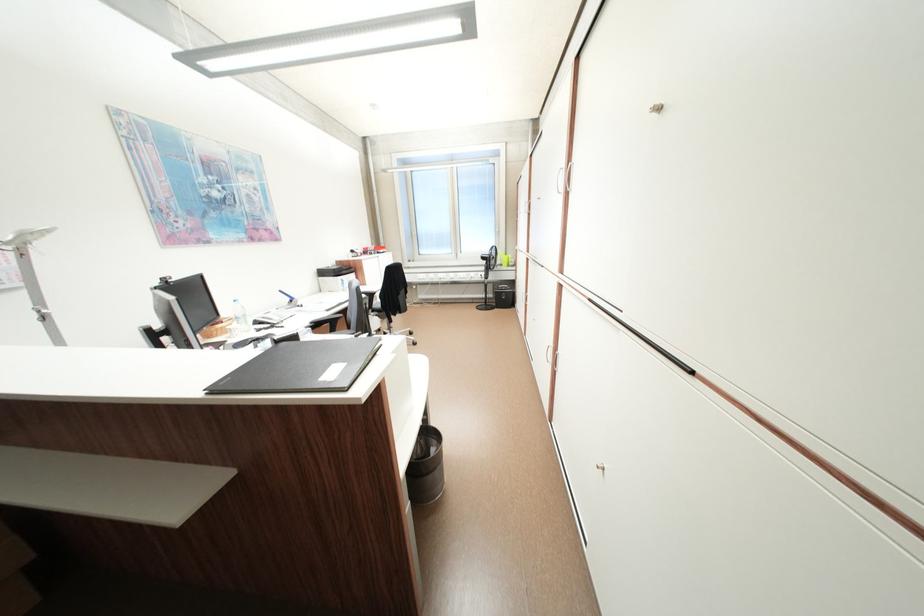
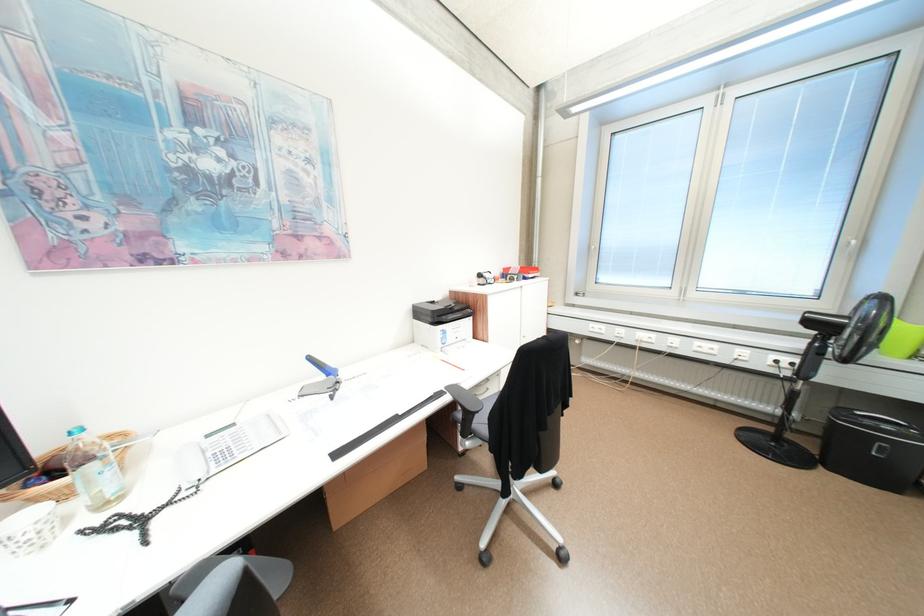
Locate, in the second image, the point that corresponds to [332,274] in the first image.

(428, 313)